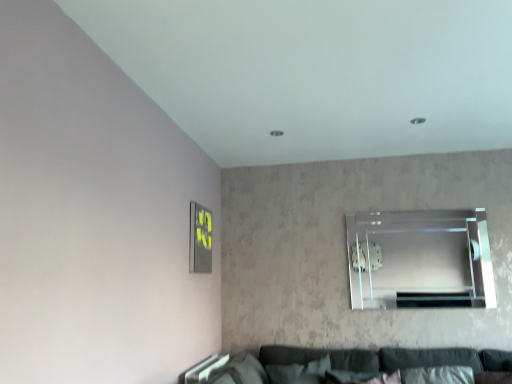
Question: Relative to metallic gray picture frame at lower left, is clear glass window at upper right in front or behind?

Choices:
 (A) front
 (B) behind

Answer: (B)

Question: Considering the positions of clear glass window at upper right and metallic gray picture frame at lower left in the image, is clear glass window at upper right bigger or smaller than metallic gray picture frame at lower left?

Choices:
 (A) small
 (B) big

Answer: (B)

Question: From the image's perspective, is clear glass window at upper right located above or below metallic gray picture frame at lower left?

Choices:
 (A) above
 (B) below

Answer: (B)

Question: Based on their sizes in the image, would you say metallic gray picture frame at lower left is bigger or smaller than clear glass window at upper right?

Choices:
 (A) big
 (B) small

Answer: (B)

Question: Considering the positions of metallic gray picture frame at lower left and clear glass window at upper right in the image, is metallic gray picture frame at lower left taller or shorter than clear glass window at upper right?

Choices:
 (A) tall
 (B) short

Answer: (B)

Question: From the image's perspective, is metallic gray picture frame at lower left above or below clear glass window at upper right?

Choices:
 (A) above
 (B) below

Answer: (A)

Question: From a real-world perspective, is metallic gray picture frame at lower left positioned above or below clear glass window at upper right?

Choices:
 (A) above
 (B) below

Answer: (A)